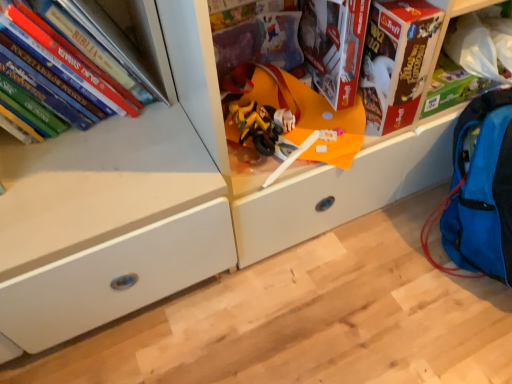
Question: Considering the relative positions of white matte drawer at center, marked as the 1th shelf in a front-to-back arrangement, and blue fabric backpack at lower right in the image provided, is white matte drawer at center, marked as the 1th shelf in a front-to-back arrangement, in front of blue fabric backpack at lower right?

Choices:
 (A) no
 (B) yes

Answer: (B)

Question: Is blue fabric backpack at lower right a part of white matte drawer at center, which is the second shelf in back-to-front order?

Choices:
 (A) yes
 (B) no

Answer: (B)

Question: Are white matte drawer at center, marked as the 1th shelf in a front-to-back arrangement, and blue fabric backpack at lower right located far from each other?

Choices:
 (A) no
 (B) yes

Answer: (A)

Question: From the image's perspective, would you say white matte drawer at center, marked as the 1th shelf in a front-to-back arrangement, is shown under blue fabric backpack at lower right?

Choices:
 (A) yes
 (B) no

Answer: (B)

Question: From a real-world perspective, is white matte drawer at center, marked as the 1th shelf in a front-to-back arrangement, physically below blue fabric backpack at lower right?

Choices:
 (A) no
 (B) yes

Answer: (A)

Question: Can you confirm if white matte drawer at center, which is the second shelf in back-to-front order, is wider than blue fabric backpack at lower right?

Choices:
 (A) yes
 (B) no

Answer: (A)

Question: Does yellow matte motorcycle at center have a smaller size compared to white matte drawer at center, marked as the 1th shelf in a front-to-back arrangement?

Choices:
 (A) yes
 (B) no

Answer: (A)

Question: Is yellow matte motorcycle at center outside white matte drawer at center, which is the second shelf in back-to-front order?

Choices:
 (A) no
 (B) yes

Answer: (A)

Question: Could white matte drawer at center, which is the second shelf in back-to-front order, be considered to be inside yellow matte motorcycle at center?

Choices:
 (A) no
 (B) yes

Answer: (A)

Question: Is yellow matte motorcycle at center to the left of white matte drawer at center, which is the second shelf in back-to-front order, from the viewer's perspective?

Choices:
 (A) no
 (B) yes

Answer: (B)

Question: Is the depth of yellow matte motorcycle at center less than that of white matte drawer at center, marked as the 1th shelf in a front-to-back arrangement?

Choices:
 (A) no
 (B) yes

Answer: (A)

Question: From the image's perspective, is yellow matte motorcycle at center under white matte drawer at center, marked as the 1th shelf in a front-to-back arrangement?

Choices:
 (A) no
 (B) yes

Answer: (B)

Question: Considering the relative positions of yellow matte motorcycle at center and cardboard box at upper right, the 2th shelf positioned from the front, in the image provided, is yellow matte motorcycle at center to the right of cardboard box at upper right, the 2th shelf positioned from the front, from the viewer's perspective?

Choices:
 (A) no
 (B) yes

Answer: (A)